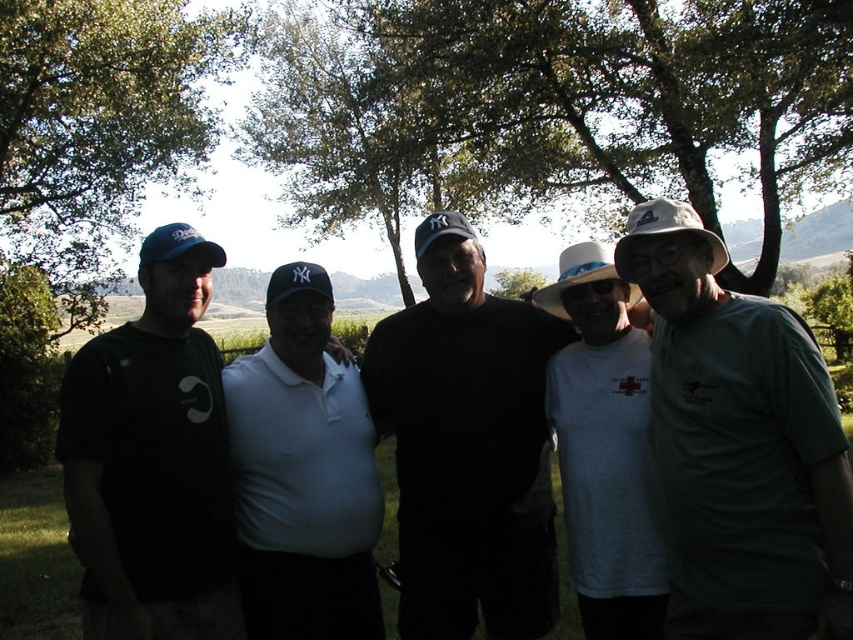
Based on the photo, who is shorter, white matte polo shirt at center or white fabric cowboy hat at right?

Standing shorter between the two is white fabric cowboy hat at right.

At what (x,y) coordinates should I click in order to perform the action: click on white matte polo shirt at center. Please return your answer as a coordinate pair (x, y). The image size is (853, 640). Looking at the image, I should click on click(303, 472).

Does green matte shirt at right appear under white matte polo shirt at center?

Actually, green matte shirt at right is above white matte polo shirt at center.

Who is shorter, green matte shirt at right or white matte polo shirt at center?

With less height is green matte shirt at right.

The height and width of the screenshot is (640, 853). I want to click on green matte shirt at right, so pos(738,445).

Can you confirm if white cotton shirt at center is wider than white fabric cowboy hat at center?

Correct, the width of white cotton shirt at center exceeds that of white fabric cowboy hat at center.

Who is taller, white cotton shirt at center or white fabric cowboy hat at center?

white cotton shirt at center is taller.

I want to click on white cotton shirt at center, so click(x=604, y=448).